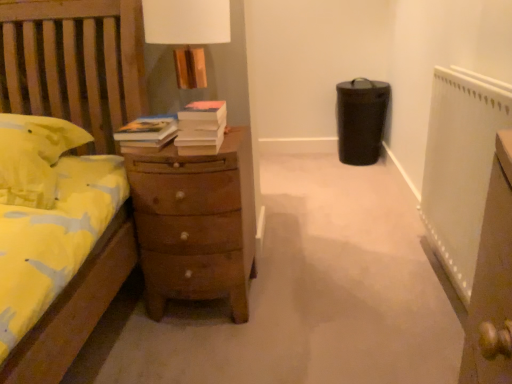
Image resolution: width=512 pixels, height=384 pixels. I want to click on white textured radiator at right, so click(x=460, y=166).

Is white matte book at center to the left or to the right of white textured radiator at right in the image?

white matte book at center is to the left of white textured radiator at right.

From the picture: Considering the sizes of objects white matte book at center and white textured radiator at right in the image provided, who is thinner, white matte book at center or white textured radiator at right?

white textured radiator at right is thinner.

Considering the relative sizes of white matte book at center and white textured radiator at right in the image provided, is white matte book at center taller than white textured radiator at right?

In fact, white matte book at center may be shorter than white textured radiator at right.

From the image's perspective, is white textured radiator at right on brown wooden chest of drawers at center?

Yes, from the image's perspective, white textured radiator at right is on top of brown wooden chest of drawers at center.

In terms of height, does white textured radiator at right look taller or shorter compared to brown wooden chest of drawers at center?

white textured radiator at right is taller than brown wooden chest of drawers at center.

Based on their positions, is white textured radiator at right located to the left or right of brown wooden chest of drawers at center?

From the image, it's evident that white textured radiator at right is to the right of brown wooden chest of drawers at center.

Measure the distance from white textured radiator at right to brown wooden chest of drawers at center.

A distance of 90.80 centimeters exists between white textured radiator at right and brown wooden chest of drawers at center.

In the image, is white textured radiator at right positioned in front of or behind white matte book at center?

white textured radiator at right is in front of white matte book at center.

From a real-world perspective, is white textured radiator at right above or below white matte book at center?

In terms of real-world spatial position, white textured radiator at right is below white matte book at center.

From the image's perspective, between white textured radiator at right and white matte book at center, which one is located above?

From the image's view, white matte book at center is above.

Locate an element on the screen. The image size is (512, 384). book behind the white textured radiator at right is located at coordinates (201, 128).

Considering the relative sizes of brown wooden chest of drawers at center and white textured radiator at right in the image provided, is brown wooden chest of drawers at center wider than white textured radiator at right?

Yes.

Based on their positions, is brown wooden chest of drawers at center located to the left or right of white textured radiator at right?

brown wooden chest of drawers at center is to the left of white textured radiator at right.

Between brown wooden chest of drawers at center and white textured radiator at right, which one has less height?

Standing shorter between the two is brown wooden chest of drawers at center.

Can you confirm if white matte book at center is smaller than brown wooden chest of drawers at center?

Yes.

Is white matte book at center turned away from brown wooden chest of drawers at center?

No, white matte book at center is not facing away from brown wooden chest of drawers at center.

Locate an element on the screen. book lying in front of the brown wooden chest of drawers at center is located at coordinates (201, 128).

Is white matte book at center surrounding brown wooden chest of drawers at center?

No.

Considering the sizes of objects brown wooden chest of drawers at center and white matte book at center in the image provided, who is thinner, brown wooden chest of drawers at center or white matte book at center?

With smaller width is white matte book at center.

Relative to white matte book at center, is brown wooden chest of drawers at center in front or behind?

In the image, brown wooden chest of drawers at center appears behind white matte book at center.

Which object is positioned more to the right, brown wooden chest of drawers at center or white matte book at center?

white matte book at center.

The image size is (512, 384). What are the coordinates of `book above the white textured radiator at right (from the image's perspective)` in the screenshot? It's located at (201, 128).

The height and width of the screenshot is (384, 512). I want to click on radiator above the brown wooden chest of drawers at center (from a real-world perspective), so click(x=460, y=166).

When comparing their distances from brown wooden chest of drawers at center, does white textured radiator at right or white matte book at center seem closer?

white matte book at center is closer to brown wooden chest of drawers at center.

Looking at the image, which one is located closer to white textured radiator at right, white matte book at center or brown wooden chest of drawers at center?

brown wooden chest of drawers at center is positioned closer to the anchor white textured radiator at right.

Estimate the real-world distances between objects in this image. Which object is further from brown wooden chest of drawers at center, white matte book at center or white textured radiator at right?

white textured radiator at right is positioned further to the anchor brown wooden chest of drawers at center.

Looking at the image, which one is located further to white textured radiator at right, brown wooden chest of drawers at center or white matte book at center?

Among the two, white matte book at center is located further to white textured radiator at right.

When comparing their distances from white matte book at center, does white textured radiator at right or brown wooden chest of drawers at center seem further?

Based on the image, white textured radiator at right appears to be further to white matte book at center.

Based on their spatial positions, is brown wooden chest of drawers at center or white textured radiator at right closer to white matte book at center?

brown wooden chest of drawers at center is closer to white matte book at center.

At what (x,y) coordinates should I click in order to perform the action: click on book located between brown wooden chest of drawers at center and white textured radiator at right in the left-right direction. Please return your answer as a coordinate pair (x, y). The image size is (512, 384). Looking at the image, I should click on (201, 128).